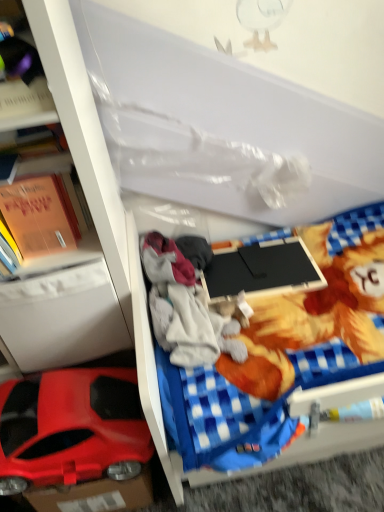
Question: Based on their positions, is shiny plastic car at lower left located to the left or right of white plastic drawer at left?

Choices:
 (A) left
 (B) right

Answer: (B)

Question: From their relative heights in the image, would you say shiny plastic car at lower left is taller or shorter than white plastic drawer at left?

Choices:
 (A) short
 (B) tall

Answer: (A)

Question: Estimate the real-world distances between objects in this image. Which object is closer to the shiny plastic car at lower left?

Choices:
 (A) white plastic drawer at left
 (B) orange paper book at left
 (C) white plastic bookshelf at left
 (D) gray fleece hoodie at center
 (E) black matte laptop at center

Answer: (A)

Question: Which is nearer to the shiny plastic car at lower left?

Choices:
 (A) white plastic bookshelf at left
 (B) black matte laptop at center
 (C) blue checkered bed frame at center
 (D) orange paper book at left
 (E) white plastic drawer at left

Answer: (E)